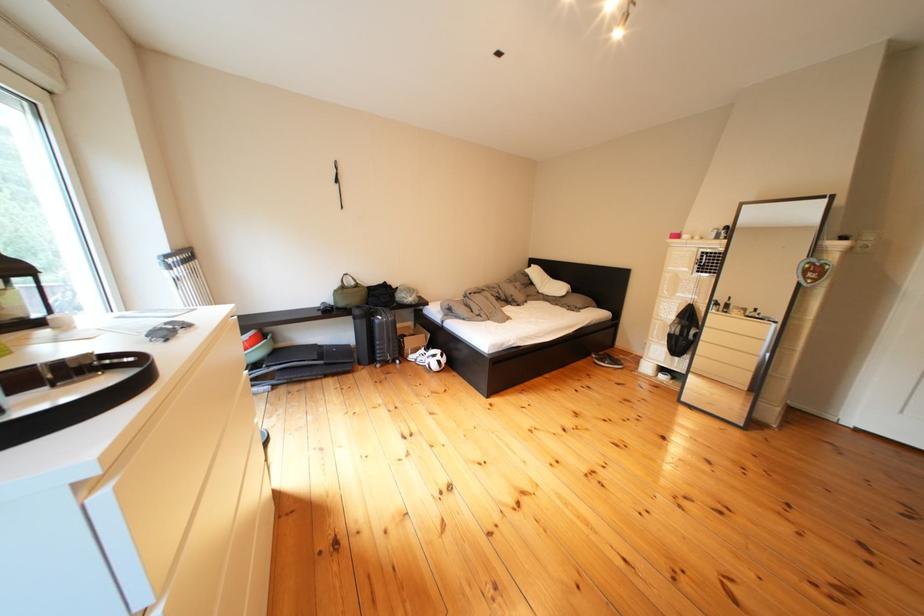
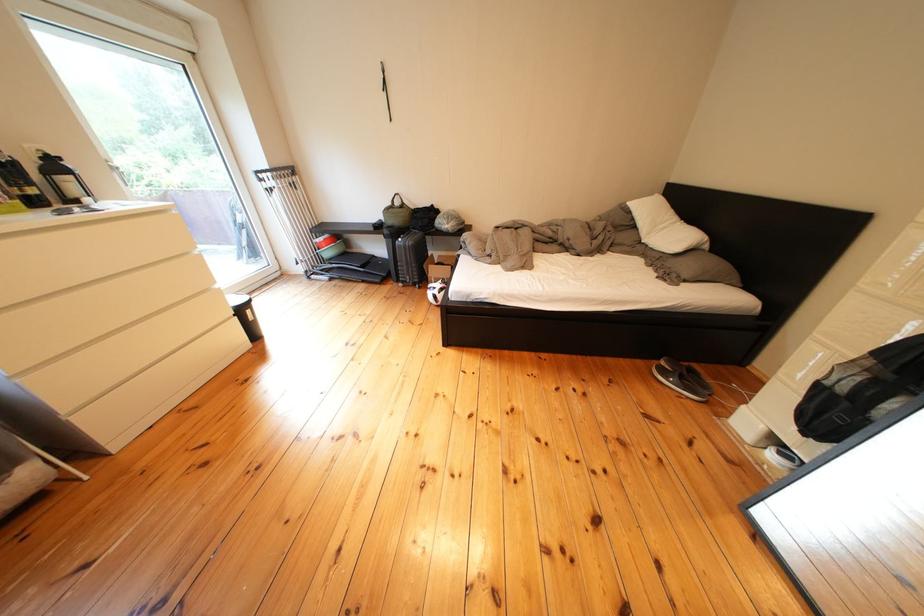
Find the pixel in the second image that matches (545,288) in the first image.

(649, 230)